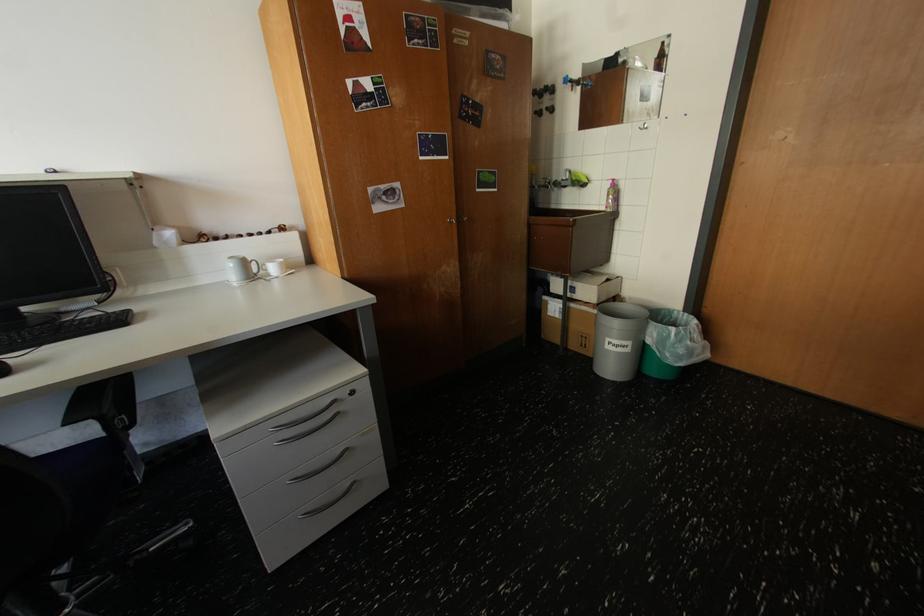
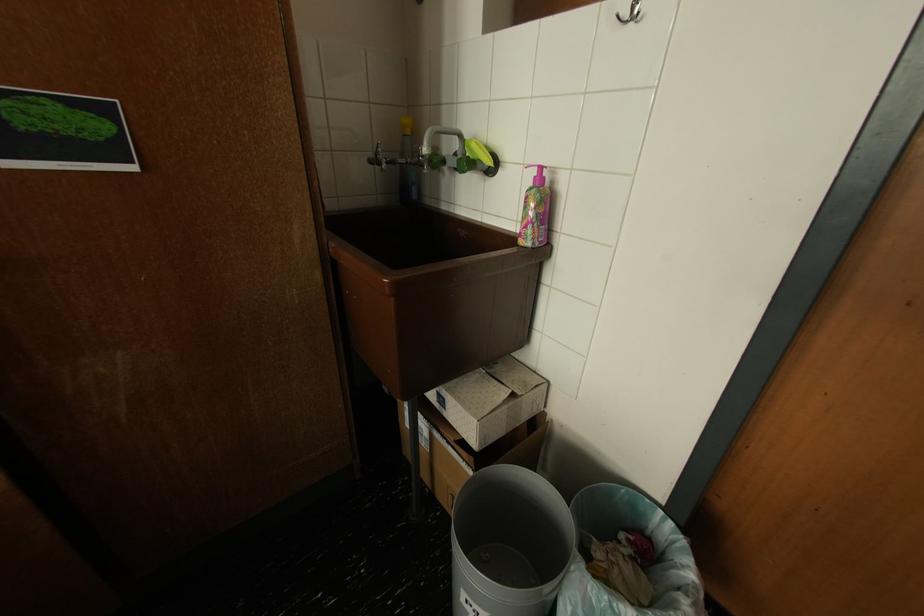
The point at (578, 174) is marked in the first image. Where is the corresponding point in the second image?

(468, 138)